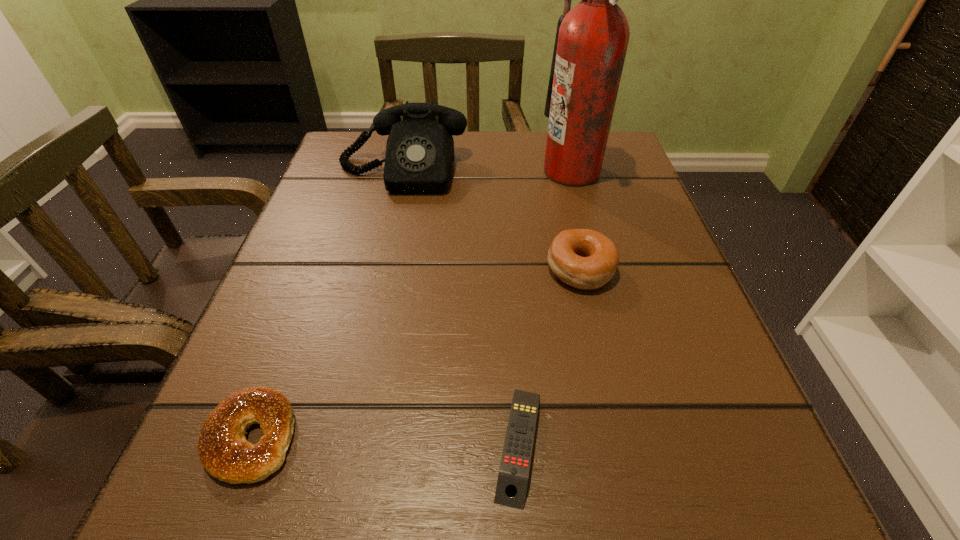
At what (x,y) coordinates should I click in order to perform the action: click on bagel that is at the left edge. Please return your answer as a coordinate pair (x, y). Looking at the image, I should click on (223, 450).

This screenshot has width=960, height=540. Find the location of `fire extinguisher that is at the right edge`. fire extinguisher that is at the right edge is located at coordinates (591, 41).

The image size is (960, 540). I want to click on bagel at the right edge, so click(x=585, y=259).

At what (x,y) coordinates should I click in order to perform the action: click on object positioned at the far left corner. Please return your answer as a coordinate pair (x, y). Image resolution: width=960 pixels, height=540 pixels. Looking at the image, I should click on (419, 158).

At what (x,y) coordinates should I click in order to perform the action: click on object located at the near left corner. Please return your answer as a coordinate pair (x, y). Looking at the image, I should click on (223, 450).

Identify the location of object at the far right corner. (591, 41).

Find the location of a particular element. vacant area at the far edge of the desktop is located at coordinates (518, 151).

The width and height of the screenshot is (960, 540). Find the location of `vacant area at the near edge of the desktop`. vacant area at the near edge of the desktop is located at coordinates (365, 468).

Identify the location of blank area at the left edge. (287, 258).

I want to click on free space at the right edge of the desktop, so click(x=673, y=340).